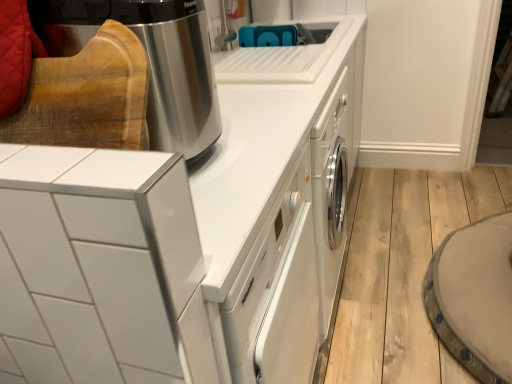
Question: Considering their positions, is white glossy dishwasher at center, arranged as the 1th home appliance when ordered from the bottom, located in front of or behind stainless steel coffee maker at upper left, the first home appliance positioned from the top?

Choices:
 (A) behind
 (B) front

Answer: (B)

Question: From the image's perspective, relative to stainless steel coffee maker at upper left, the first home appliance positioned from the top, is white glossy dishwasher at center, arranged as the 1th home appliance when ordered from the bottom, above or below?

Choices:
 (A) above
 (B) below

Answer: (B)

Question: Considering the real-world distances, which object is closest to the white glossy dishwasher at center, arranged as the 1th home appliance when ordered from the bottom?

Choices:
 (A) stainless steel coffee maker at upper left, the first home appliance positioned from the top
 (B) white glossy cabinet at upper left, the 2th home appliance when ordered from top to bottom

Answer: (B)

Question: Estimate the real-world distances between objects in this image. Which object is closer to the white glossy dishwasher at center, arranged as the 1th home appliance when ordered from the bottom?

Choices:
 (A) stainless steel coffee maker at upper left, the first home appliance positioned from the top
 (B) white glossy cabinet at upper left, which ranks as the 2th home appliance in bottom-to-top order

Answer: (B)